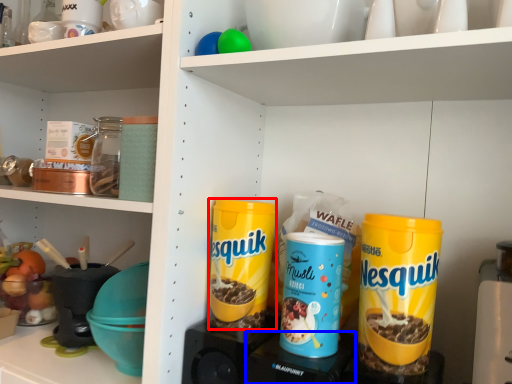
Question: Among these objects, which one is nearest to the camera, cereal (highlighted by a red box) or appliance (highlighted by a blue box)?

Choices:
 (A) cereal
 (B) appliance

Answer: (B)